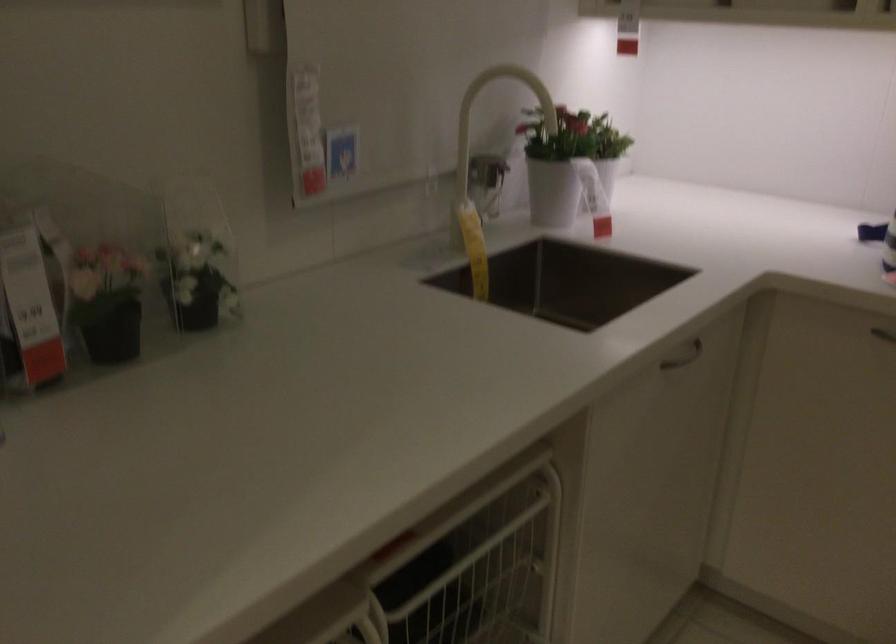
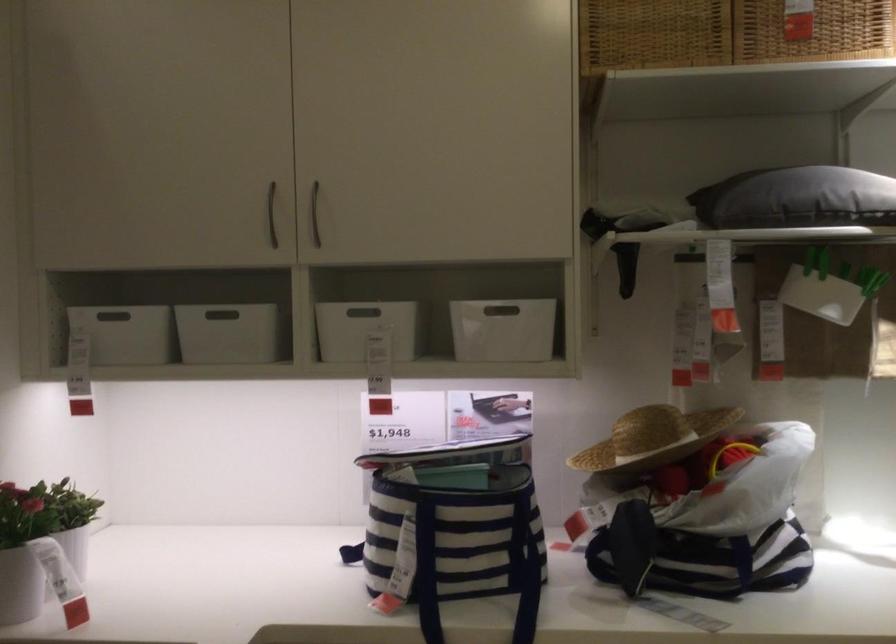
The images are taken continuously from a first-person perspective. In which direction is your viewpoint rotating?

The rotation direction of the camera is right-up.